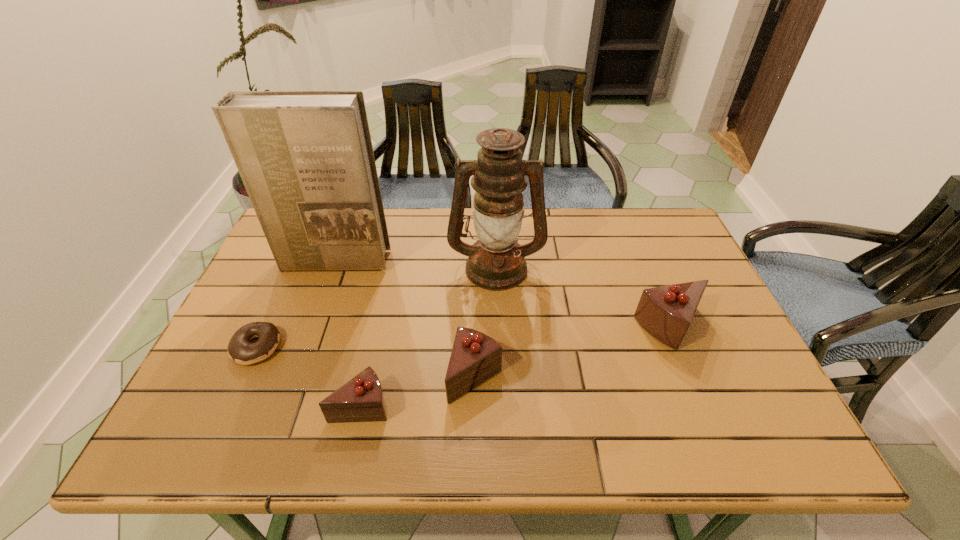
Please determine a free point for an extra chocolate_cake to ensure balance. Please provide its 2D coordinates. Your answer should be formatted as a tuple, i.e. [(x, y)], where the tuple contains the x and y coordinates of a point satisfying the conditions above.

[(578, 350)]